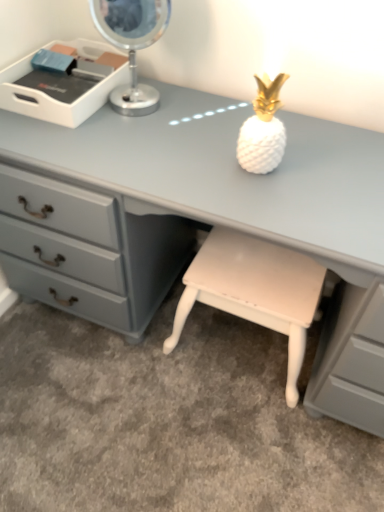
Locate an element on the screen. The image size is (384, 512). free point to the right of metallic silver table lamp at upper left is located at coordinates (201, 114).